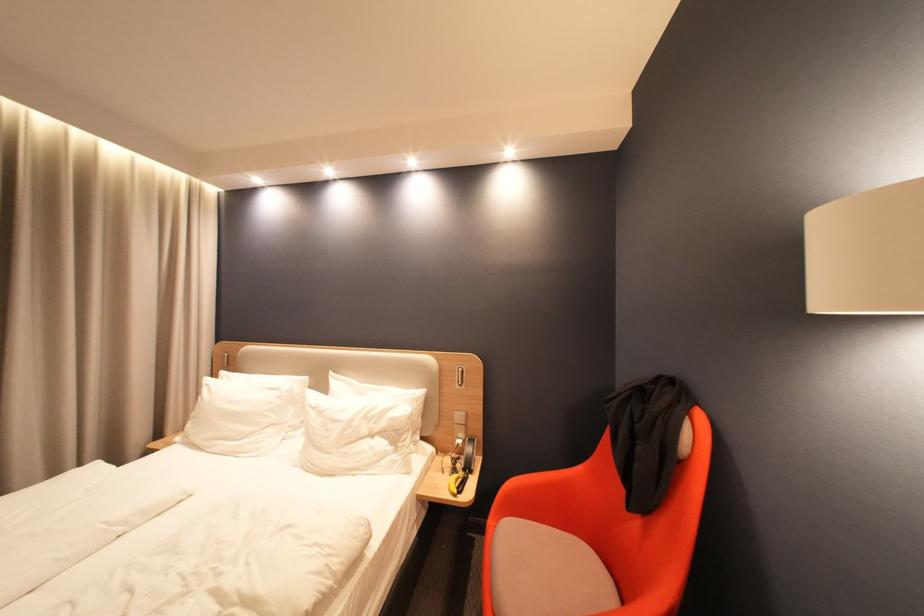
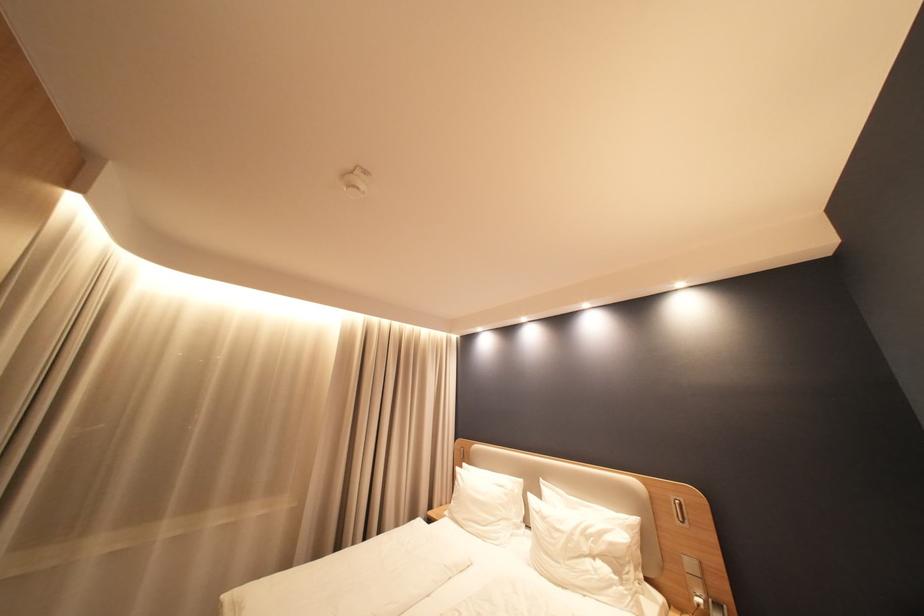
Locate, in the second image, the point that corresponds to the point at 216,386 in the first image.

(468, 475)